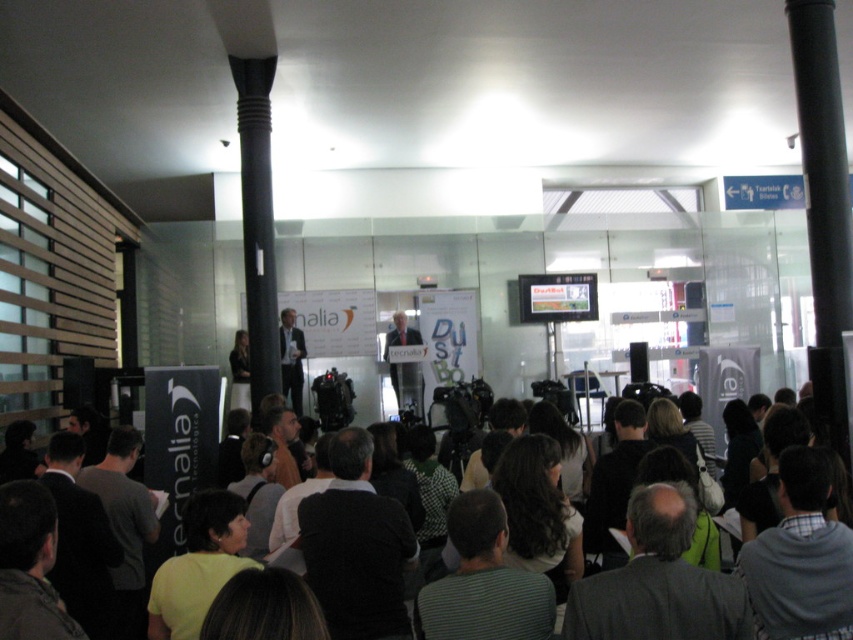
Does point (405, 378) lie in front of point (289, 333)?

No.

In the scene shown: Does matte black suit at center have a greater height compared to dark suit at center?

Incorrect, matte black suit at center's height is not larger of dark suit at center's.

Between point (402, 403) and point (286, 385), which one is positioned in front?

Point (286, 385) is more forward.

Image resolution: width=853 pixels, height=640 pixels. In order to click on matte black suit at center in this screenshot , I will do `click(403, 364)`.

Between point (595, 637) and point (421, 397), which one is positioned behind?

The point (421, 397) is behind.

Can you confirm if dark gray clothing at center is smaller than matte black suit at center?

No.

Is point (715, 593) in front of point (405, 321)?

Yes, point (715, 593) is in front of point (405, 321).

Find the location of `dark gray clothing at center`. dark gray clothing at center is located at coordinates (799, 547).

Can you confirm if dark gray clothing at center is bigger than dark suit at center?

Actually, dark gray clothing at center might be smaller than dark suit at center.

Is point (840, 584) more distant than point (288, 378)?

No, it is not.

Locate an element on the screen. dark gray clothing at center is located at coordinates (799, 547).